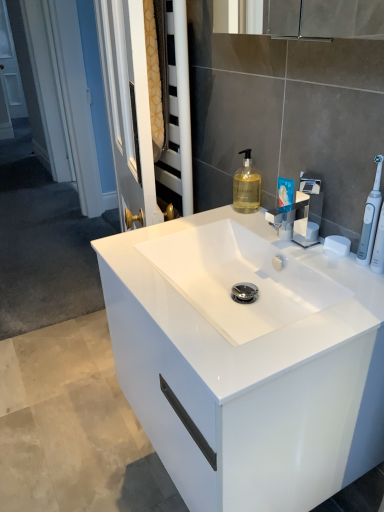
The image size is (384, 512). In order to click on free location in front of white matte soap at upper right in this screenshot , I will do `click(345, 289)`.